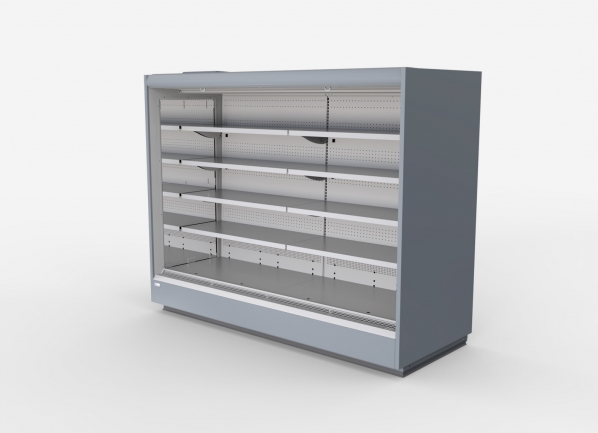
Find the location of a particular element. The width and height of the screenshot is (598, 433). fifth and top shelf is located at coordinates (271, 132).